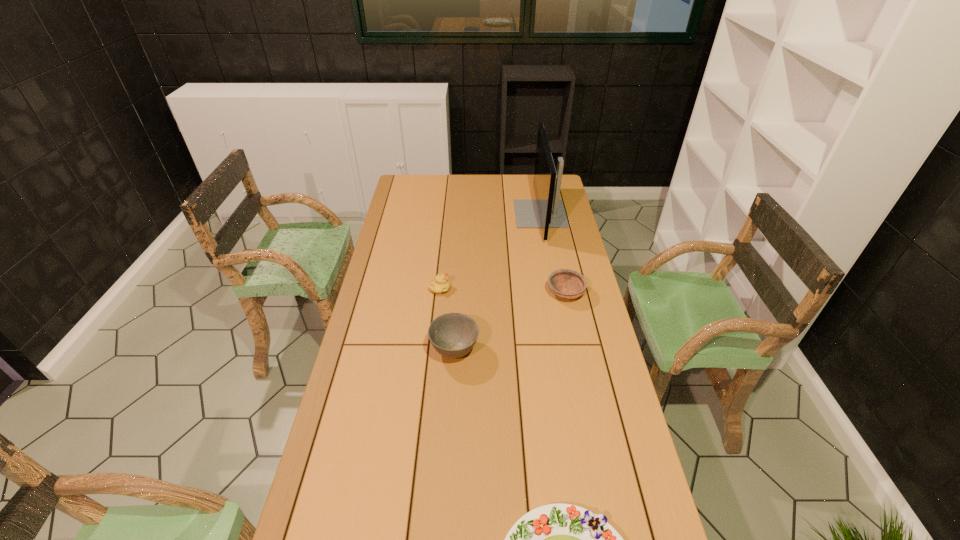
In order to click on free point that satisfies the following two spatial constraints: 1. on the beak of the duckling; 2. on the left side of the shorter bowl in this screenshot , I will do [x=440, y=293].

Where is `vacant area that satisfies the following two spatial constraints: 1. on the back side of the second shortest object; 2. on the beak of the duckling`? This screenshot has height=540, width=960. vacant area that satisfies the following two spatial constraints: 1. on the back side of the second shortest object; 2. on the beak of the duckling is located at coordinates (564, 288).

Image resolution: width=960 pixels, height=540 pixels. I want to click on vacant space that satisfies the following two spatial constraints: 1. on the back side of the fourth tallest object; 2. on the screen of the tallest object, so click(549, 214).

In order to click on vacant area in the image that satisfies the following two spatial constraints: 1. on the beak of the duckling; 2. on the back side of the shorter bowl in this screenshot , I will do `click(440, 293)`.